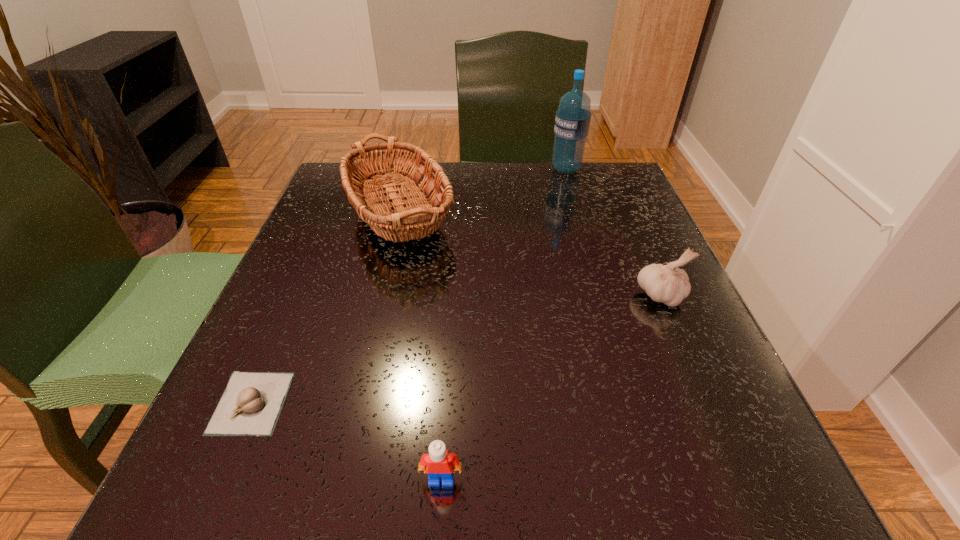
At what (x,y) coordinates should I click in order to perform the action: click on object located in the far left corner section of the desktop. Please return your answer as a coordinate pair (x, y). The width and height of the screenshot is (960, 540). Looking at the image, I should click on (412, 219).

Identify the location of object that is at the far right corner. (572, 122).

In the image, there is a desktop. Where is `blank space at the far edge`? blank space at the far edge is located at coordinates (490, 181).

Locate an element on the screen. vacant space at the near edge of the desktop is located at coordinates (460, 451).

Image resolution: width=960 pixels, height=540 pixels. In order to click on vacant area at the left edge of the desktop in this screenshot , I will do `click(276, 435)`.

In the image, there is a desktop. Identify the location of free space at the right edge. The image size is (960, 540). (673, 400).

I want to click on vacant area at the far right corner, so click(636, 199).

The width and height of the screenshot is (960, 540). I want to click on free space at the near right corner of the desktop, so click(664, 461).

At what (x,y) coordinates should I click in order to perform the action: click on free area in between the nearest object and the nearer garlic. Please return your answer as a coordinate pair (x, y). Image resolution: width=960 pixels, height=540 pixels. Looking at the image, I should click on tap(347, 441).

What are the coordinates of `free space that is in between the tallest object and the nearest object` in the screenshot? It's located at (504, 324).